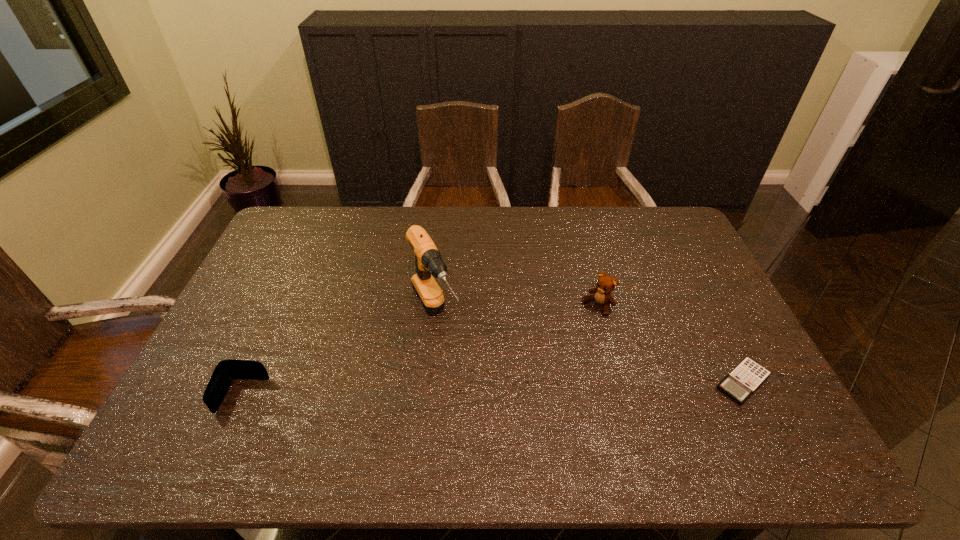
This screenshot has width=960, height=540. What are the coordinates of `vacant space in between the third shortest object and the shortest object` in the screenshot? It's located at (670, 344).

Image resolution: width=960 pixels, height=540 pixels. In order to click on free space between the tallest object and the teddy bear in this screenshot , I will do `click(516, 310)`.

You are a GUI agent. You are given a task and a screenshot of the screen. Output one action in this format:
    pyautogui.click(x=<x>, y=<y>)
    Task: Click on the free spot between the calculator and the drill
    The width and height of the screenshot is (960, 540).
    Given the screenshot: What is the action you would take?
    pyautogui.click(x=589, y=349)

This screenshot has height=540, width=960. I want to click on free space between the third tallest object and the rightmost object, so click(492, 389).

In order to click on free space that is in between the third object from right to left and the calculator in this screenshot , I will do `click(589, 349)`.

Find the location of a particular element. Image resolution: width=960 pixels, height=540 pixels. vacant area between the wallet and the second object from left to right is located at coordinates (339, 356).

Where is `object that is the closest to the second object from right to left`? object that is the closest to the second object from right to left is located at coordinates (747, 376).

I want to click on the third closest object to the third object from left to right, so click(226, 370).

At what (x,y) coordinates should I click in order to perform the action: click on vacant area that satisfies the following two spatial constraints: 1. on the front side of the rightmost object; 2. on the right side of the tallest object. Please return your answer as a coordinate pair (x, y). The width and height of the screenshot is (960, 540). Looking at the image, I should click on (429, 382).